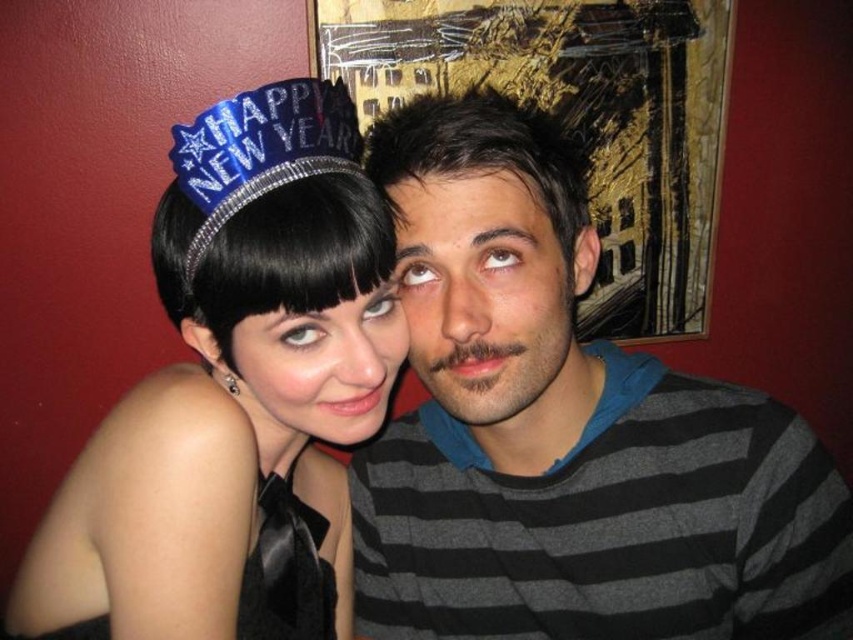
You are standing in front of the image and want to know how far the point at coordinates (364, 289) is from you. Can you determine the distance?

The point at coordinates (364, 289) is 22.81 inches from the viewer.

You are taking a photo of the scene and want to ensure the blue sequined crown at upper left is centered in the frame. Given its current position at coordinates point 0.236, 0.306, what adjustment should you make to the camera to center it?

To center the blue sequined crown at upper left, adjust the camera so that its position aligns with the center coordinates of the frame. Since the crown is at point (260,150), move the camera slightly to the right and down to bring it to the center.

You are a photographer adjusting the lighting for a portrait. You notice the satin black tiara at upper left and the matte black hair at center. Which object should you focus your spotlight on to ensure it stands out more due to its size?

The satin black tiara at upper left has a larger size compared to matte black hair at center, so focusing the spotlight on the satin black tiara at upper left will make it stand out more due to its size.